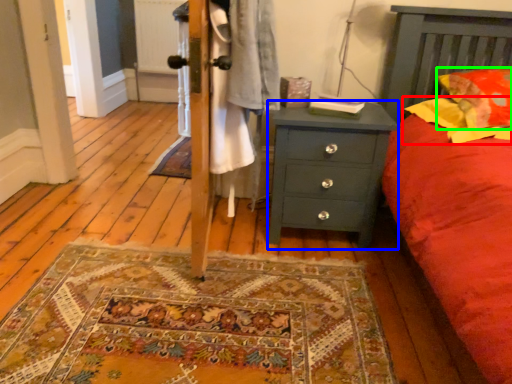
Question: Based on their relative distances, which object is nearer to pillow (highlighted by a red box)? Choose from chest of drawers (highlighted by a blue box) and pillow (highlighted by a green box).

Choices:
 (A) chest of drawers
 (B) pillow

Answer: (B)